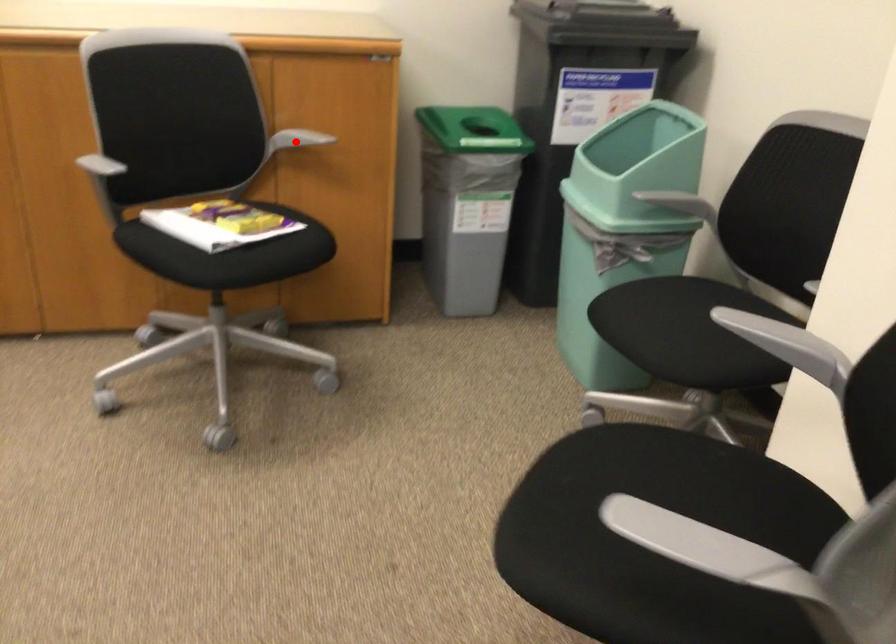
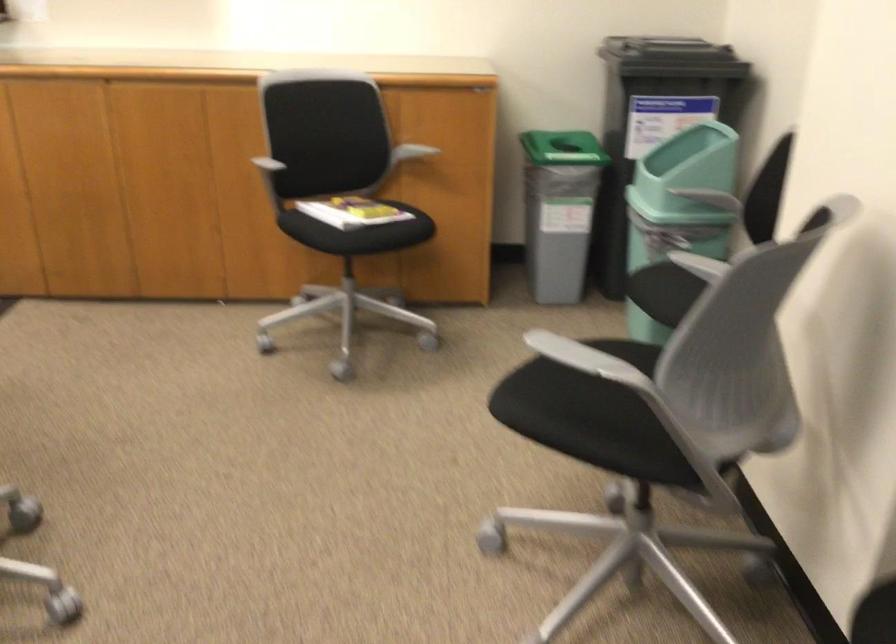
Locate, in the second image, the point that corresponds to the highlighted location in the first image.

(409, 152)